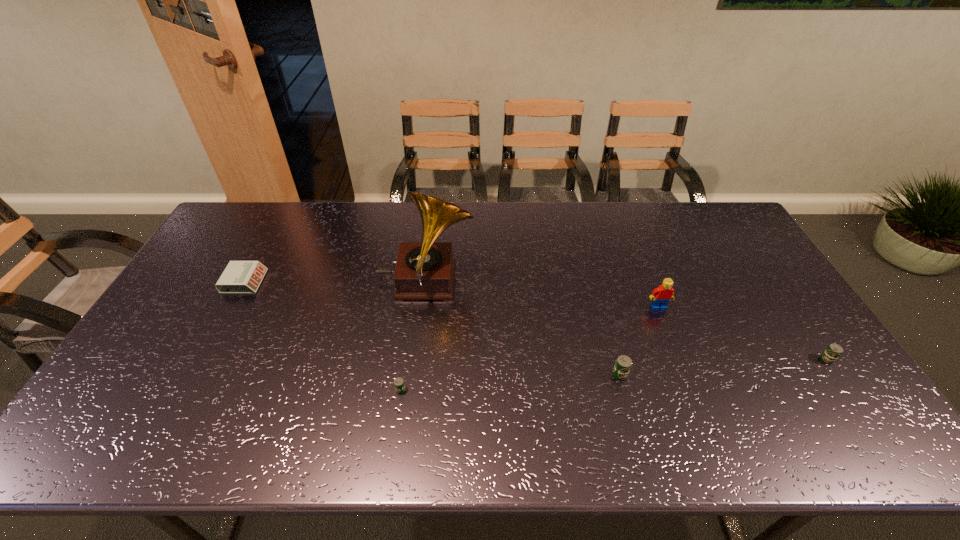
Find the location of a particular element. The width and height of the screenshot is (960, 540). vacant space located on the right of the tallest beer can is located at coordinates (708, 374).

Locate an element on the screen. This screenshot has height=540, width=960. vacant region located 0.060m on the back of the second shortest beer can is located at coordinates (806, 330).

You are a GUI agent. You are given a task and a screenshot of the screen. Output one action in this format:
    pyautogui.click(x=<x>, y=<y>)
    Task: Click on the vacant space located 0.250m on the face of the second object from right to left
    
    Given the screenshot: What is the action you would take?
    pyautogui.click(x=688, y=383)

I want to click on vacant space situated on the right of the leftmost object, so click(x=281, y=281).

This screenshot has height=540, width=960. Identify the location of vacant space located from the horn of the tallest object. (594, 281).

Locate an element on the screen. The height and width of the screenshot is (540, 960). object at the left edge is located at coordinates (239, 277).

The width and height of the screenshot is (960, 540). I want to click on object located in the right edge section of the desktop, so click(833, 351).

Find the location of a particular element. This screenshot has height=540, width=960. vacant area at the far edge is located at coordinates (669, 225).

You are a GUI agent. You are given a task and a screenshot of the screen. Output one action in this format:
    pyautogui.click(x=<x>, y=<y>)
    Task: Click on the free point at the near edge
    This screenshot has height=540, width=960.
    Given the screenshot: What is the action you would take?
    pyautogui.click(x=190, y=408)

Locate an element on the screen. This screenshot has width=960, height=540. vacant space at the left edge of the desktop is located at coordinates (209, 280).